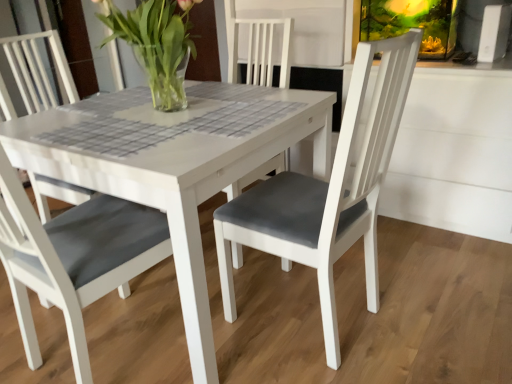
Question: Considering the positions of point (125, 296) and point (179, 97), is point (125, 296) closer or farther from the camera than point (179, 97)?

Choices:
 (A) closer
 (B) farther

Answer: (B)

Question: Is matte gray cushion at center bigger or smaller than clear glass vase at center?

Choices:
 (A) big
 (B) small

Answer: (A)

Question: Would you say matte gray cushion at center is inside or outside clear glass vase at center?

Choices:
 (A) outside
 (B) inside

Answer: (A)

Question: From the image's perspective, relative to matte gray cushion at center, is clear glass vase at center above or below?

Choices:
 (A) above
 (B) below

Answer: (A)

Question: Considering their positions, is clear glass vase at center located in front of or behind matte gray cushion at center?

Choices:
 (A) front
 (B) behind

Answer: (B)

Question: Is point (181, 82) closer or farther from the camera than point (38, 360)?

Choices:
 (A) closer
 (B) farther

Answer: (B)

Question: Do you think clear glass vase at center is within matte gray cushion at center, or outside of it?

Choices:
 (A) inside
 (B) outside

Answer: (B)